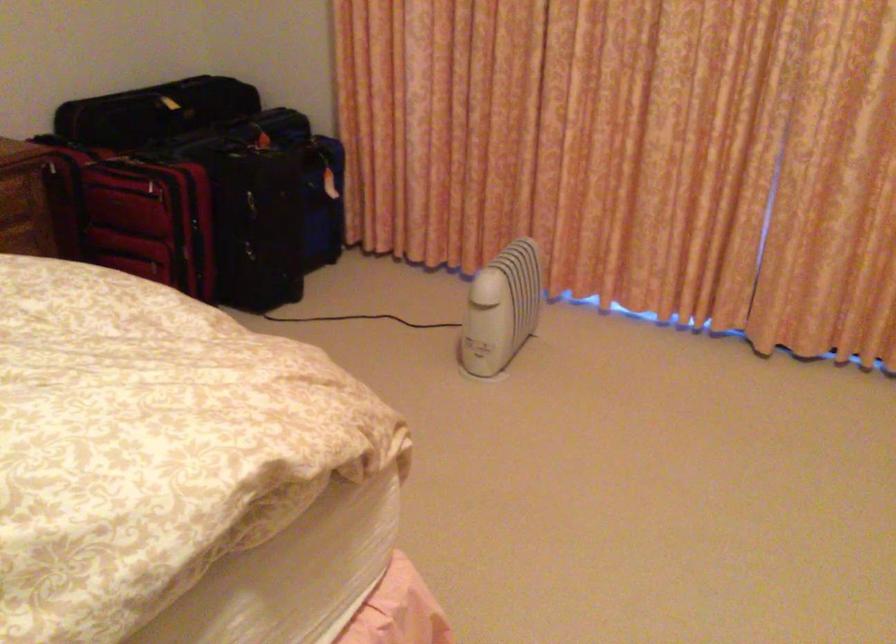
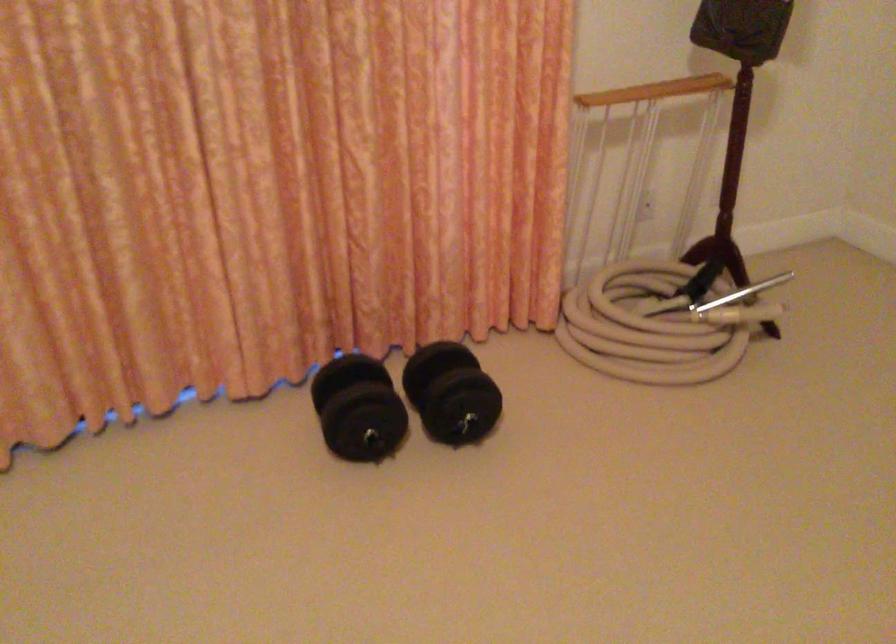
Question: The camera is either moving clockwise (left) or counter-clockwise (right) around the object. The first image is from the beginning of the video and the second image is from the end. Is the camera moving left or right when shooting the video?

Choices:
 (A) Left
 (B) Right

Answer: (A)